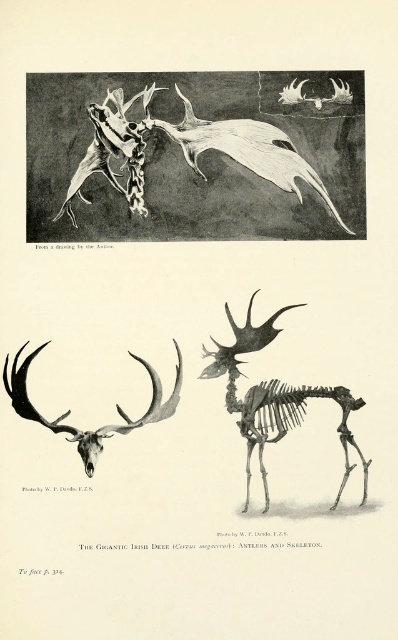
Question: Which of the following is the farthest from the observer?

Choices:
 (A) (33, 419)
 (B) (261, 403)
 (C) (292, 164)

Answer: (C)

Question: Can you confirm if bone-like antlers at upper center is positioned above black bone antlers at center?

Choices:
 (A) no
 (B) yes

Answer: (B)

Question: Is bone-like antlers at upper center to the left of bone-like skeleton at center from the viewer's perspective?

Choices:
 (A) no
 (B) yes

Answer: (B)

Question: Can you confirm if bone-like antlers at upper center is positioned to the left of bone-like skeleton at center?

Choices:
 (A) yes
 (B) no

Answer: (A)

Question: Which of the following is the closest to the observer?

Choices:
 (A) black bone antlers at center
 (B) bone-like antlers at upper center

Answer: (A)

Question: Which of these objects is positioned closest to the bone-like antlers at upper center?

Choices:
 (A) black bone antlers at center
 (B) bone-like skeleton at center

Answer: (B)